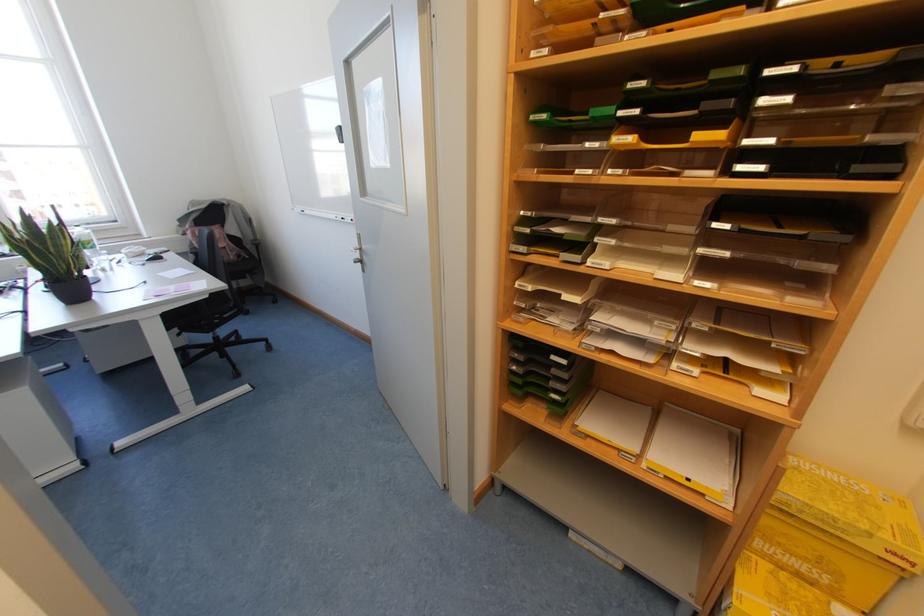
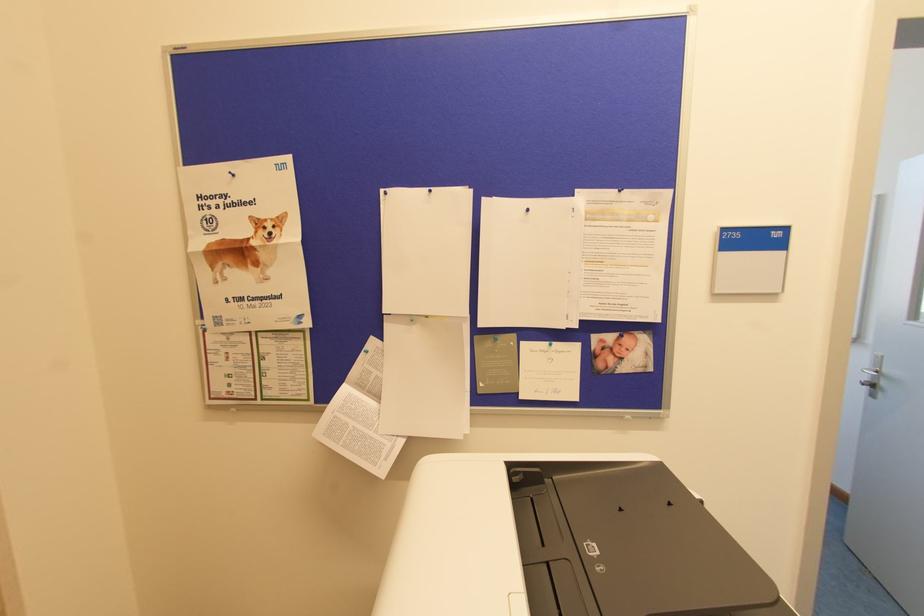
The point at (358,259) is marked in the first image. Where is the corresponding point in the second image?

(868, 382)